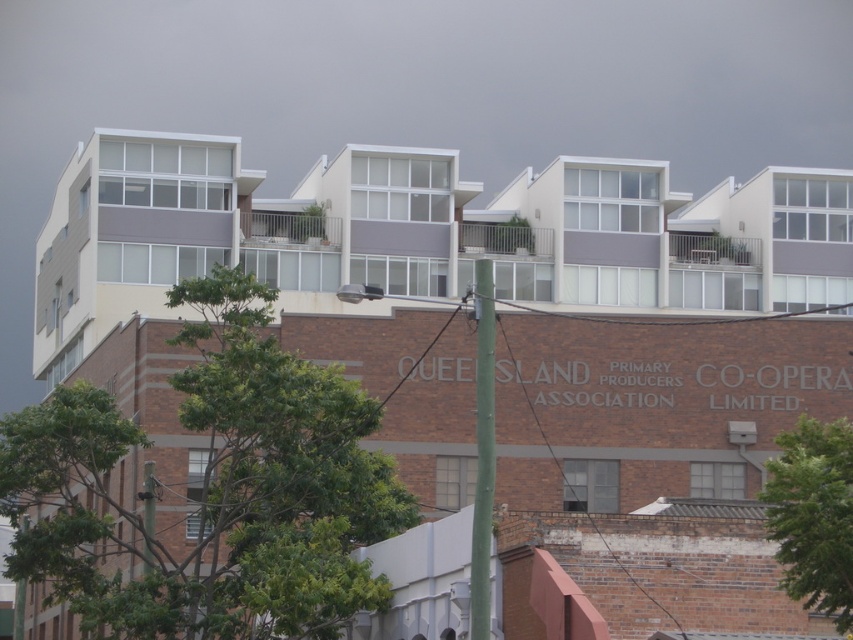
You are a photographer trying to capture the building in the background without any obstructions. You notice the green leafy tree at lower right and the green textured pole at center. Which object should you move to avoid blocking your view of the building?

The green leafy tree at lower right is in front of the green textured pole at center, so you should move the green leafy tree at lower right to avoid blocking your view of the building.

You are standing in front of the building and want to take a photo that includes both the point at coordinates point (207, 548) and point (483, 368). Based on their positions, which point will appear closer to the camera in the photo?

Point (207, 548) is further to the camera than point (483, 368), so in the photo, point (207, 548) will appear closer to the camera than point (483, 368).

You are standing in front of the building and notice two points marked on the image. The first point is at coordinates point (253, 625), and the second is at point (787, 563). Which point is closer to you?

Point (253, 625) is further to the camera than point (787, 563), so the point closer to you is point (787, 563).